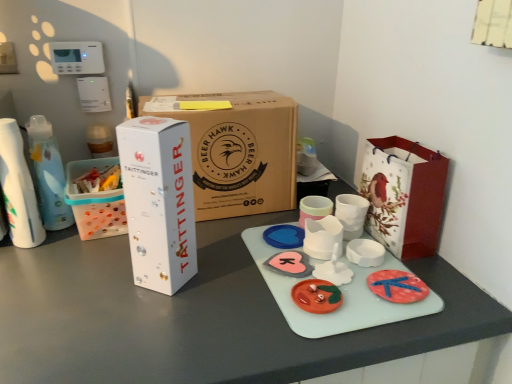
Where is `free spot to the right of pink matte heart at center, arranged as the 2th toy when viewed from the back`? free spot to the right of pink matte heart at center, arranged as the 2th toy when viewed from the back is located at coordinates (362, 269).